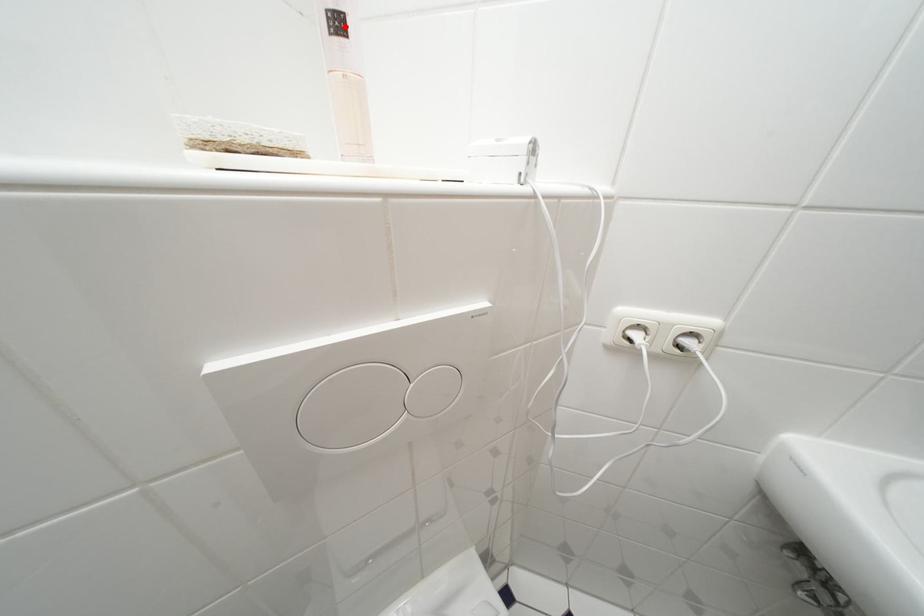
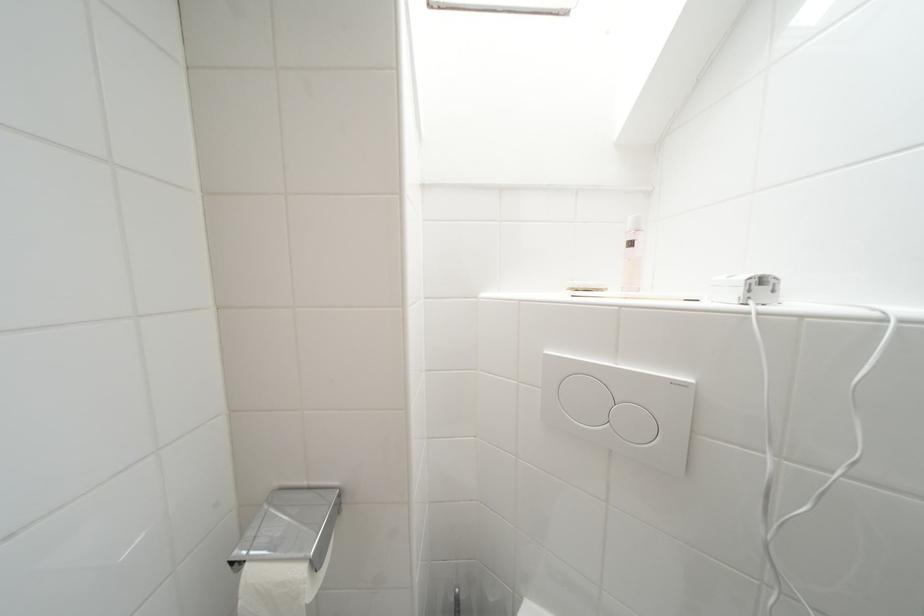
Locate, in the second image, the point that corresponds to the highlighted location in the first image.

(638, 246)